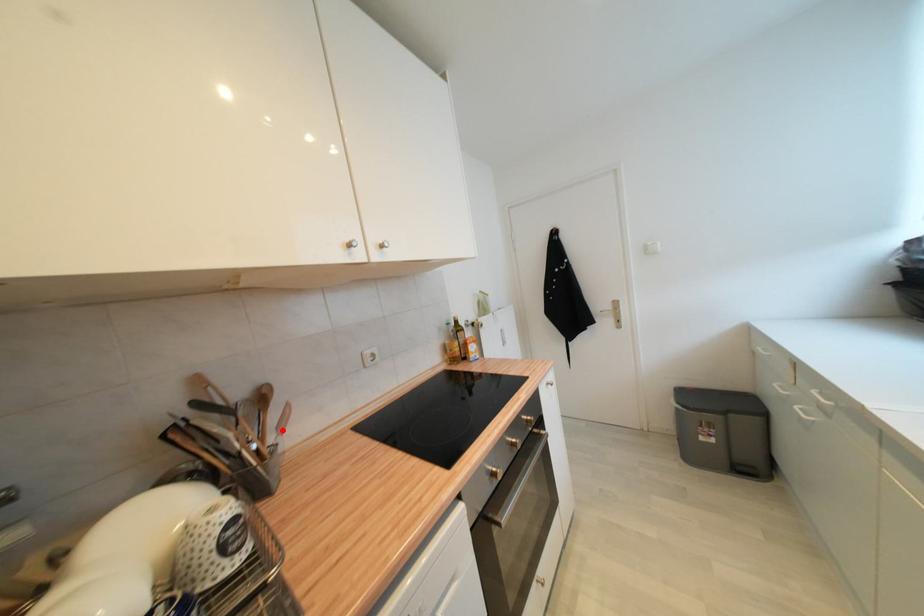
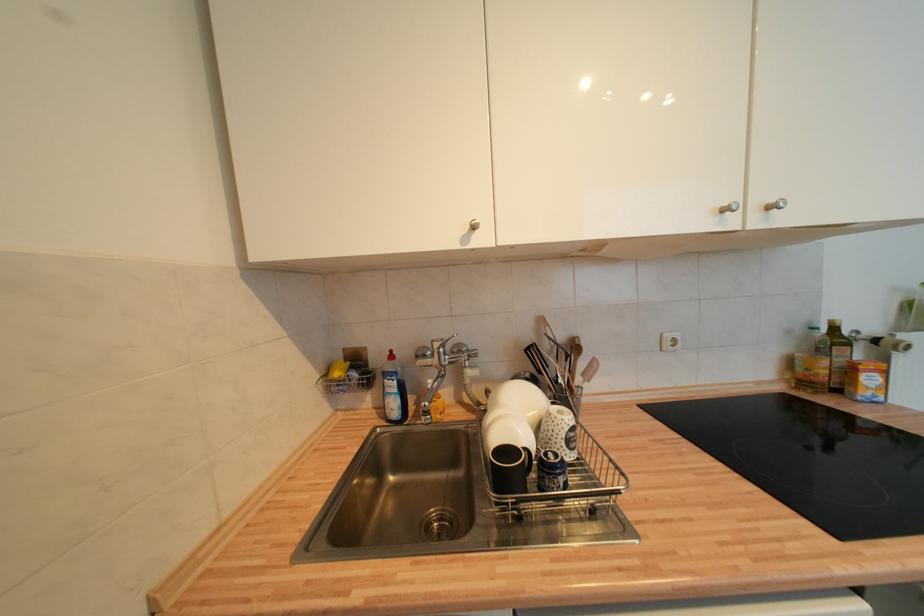
Question: I am providing you with two images of the same scene from different viewpoints. In image1, a red point is highlighted. Considering the same 3D point in image2, which of the following is correct?

Choices:
 (A) It is closer
 (B) It is farther

Answer: (B)